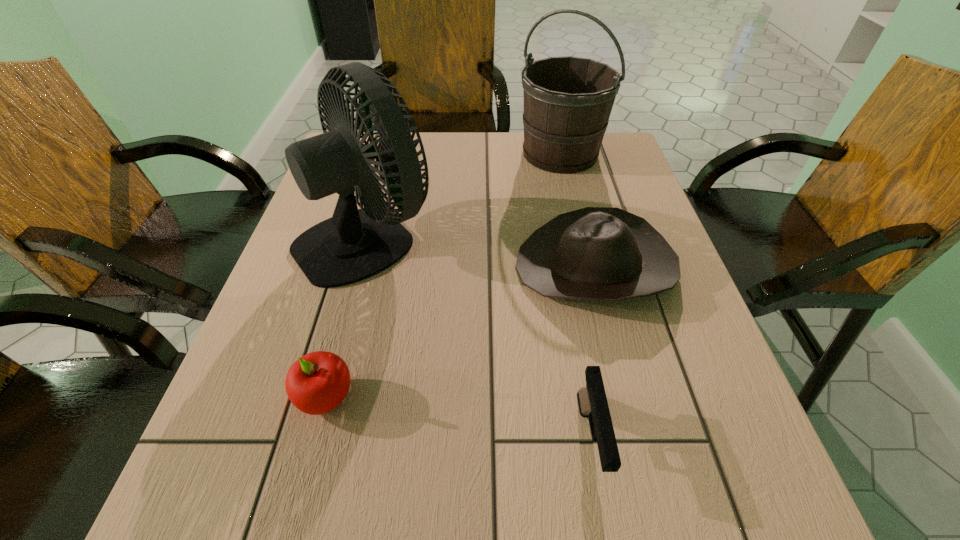
The height and width of the screenshot is (540, 960). I want to click on object that is at the far edge, so click(568, 100).

Find the location of `object at the near edge`. object at the near edge is located at coordinates (592, 401).

Identify the location of fan located at the left edge. (354, 244).

Image resolution: width=960 pixels, height=540 pixels. What are the coordinates of `apple that is positioned at the left edge` in the screenshot? It's located at (316, 383).

Where is `bucket at the right edge`? This screenshot has height=540, width=960. bucket at the right edge is located at coordinates (568, 100).

The image size is (960, 540). I want to click on cowboy hat situated at the right edge, so click(x=595, y=253).

I want to click on object located at the far right corner, so click(568, 100).

Find the location of a particular element. This screenshot has width=960, height=540. vacant space at the far edge of the desktop is located at coordinates (432, 156).

Find the location of `vacant space at the near edge of the desktop`. vacant space at the near edge of the desktop is located at coordinates (372, 532).

I want to click on vacant space at the left edge of the desktop, so click(288, 318).